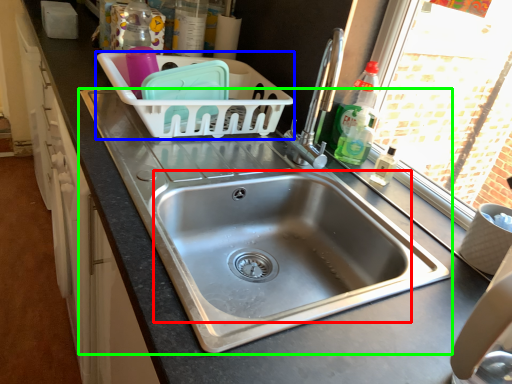
Question: Which is farther away from sink (highlighted by a red box)? basket (highlighted by a blue box) or sink (highlighted by a green box)?

Choices:
 (A) basket
 (B) sink

Answer: (A)